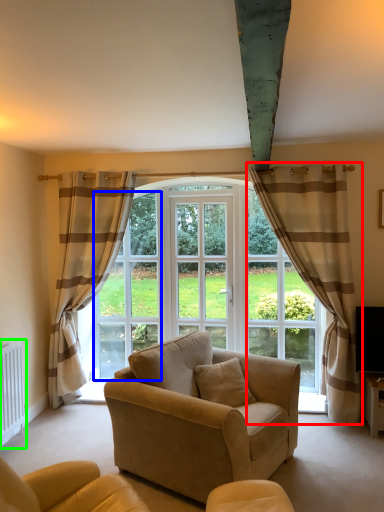
Question: Based on their relative distances, which object is nearer to curtain (highlighted by a red box)? Choose from window screen (highlighted by a blue box) and radiator (highlighted by a green box).

Choices:
 (A) window screen
 (B) radiator

Answer: (A)